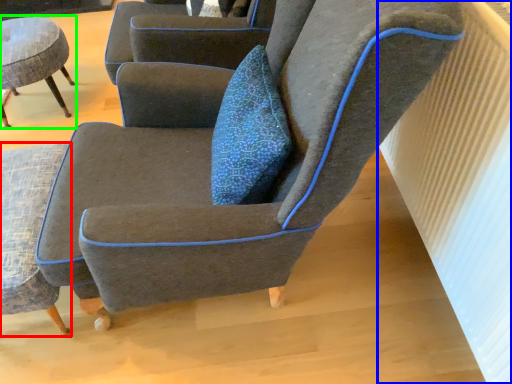
Question: Estimate the real-world distances between objects in this image. Which object is closer to chair (highlighted by a red box), radiator (highlighted by a blue box) or chair (highlighted by a green box)?

Choices:
 (A) radiator
 (B) chair

Answer: (B)